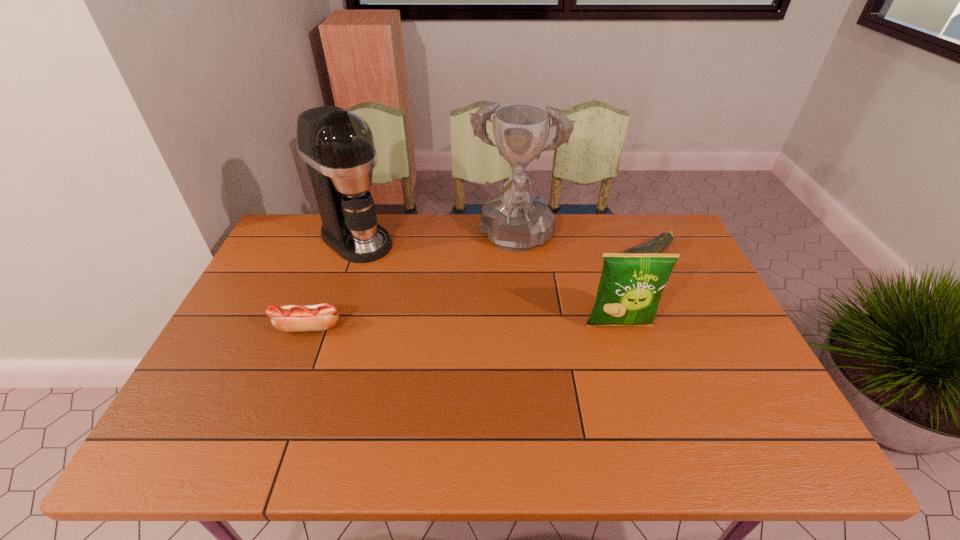
Identify the location of sausage. The height and width of the screenshot is (540, 960). tap(292, 318).

Where is `the third shortest object`? The image size is (960, 540). the third shortest object is located at coordinates (631, 284).

Identify the location of coffee maker. The height and width of the screenshot is (540, 960). (337, 145).

Locate an element on the screen. zucchini is located at coordinates (657, 245).

Locate an element on the screen. award is located at coordinates (515, 222).

At what (x,y) coordinates should I click in order to perform the action: click on blank space located on the front of the sausage. Please return your answer as a coordinate pair (x, y). The width and height of the screenshot is (960, 540). Looking at the image, I should click on coord(283,393).

Locate an element on the screen. vacant space located 0.220m on the front-facing side of the third tallest object is located at coordinates [x=645, y=409].

This screenshot has height=540, width=960. In order to click on blank area located place cup under the spout of the coffee maker in this screenshot , I will do `click(410, 282)`.

Identify the location of vacant space located place cup under the spout of the coffee maker. This screenshot has height=540, width=960. (389, 265).

Identify the location of vacant point located 0.270m place cup under the spout of the coffee maker. (432, 299).